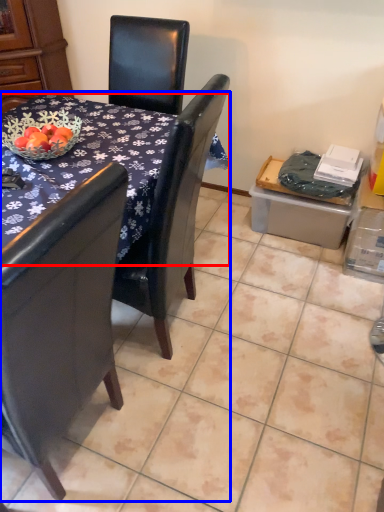
Question: Which object is closer to the camera taking this photo, desk (highlighted by a red box) or table (highlighted by a blue box)?

Choices:
 (A) desk
 (B) table

Answer: (B)